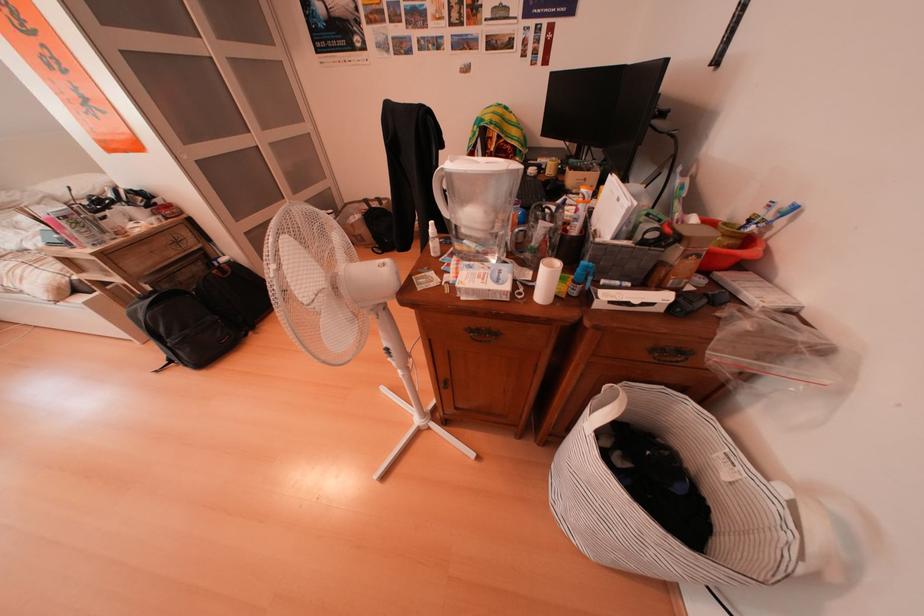
The height and width of the screenshot is (616, 924). Describe the element at coordinates (484, 365) in the screenshot. I see `a dark drawer handle` at that location.